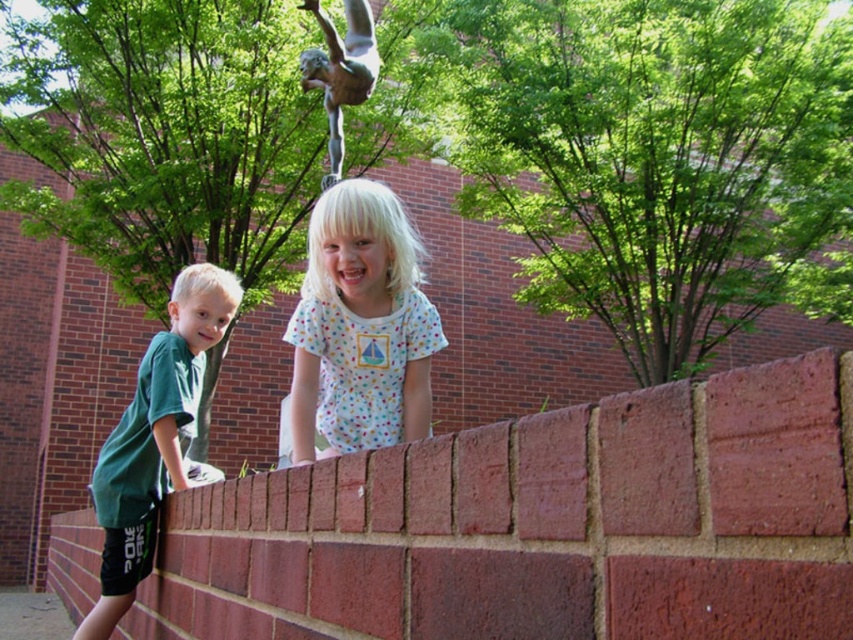
Question: From the image, what is the correct spatial relationship of green matte shirt at left in relation to green patina statue at upper center?

Choices:
 (A) right
 (B) left

Answer: (B)

Question: Where is green matte shirt at left located in relation to green patina statue at upper center in the image?

Choices:
 (A) right
 (B) left

Answer: (B)

Question: Based on their relative distances, which object is nearer to the brick wall at center?

Choices:
 (A) white dotted shirt at center
 (B) green patina statue at upper center

Answer: (A)

Question: Which object is farther from the camera taking this photo?

Choices:
 (A) green matte shirt at left
 (B) green patina statue at upper center
 (C) brick wall at center
 (D) white dotted shirt at center

Answer: (B)

Question: Is brick wall at center to the left of green patina statue at upper center from the viewer's perspective?

Choices:
 (A) no
 (B) yes

Answer: (A)

Question: Which object is positioned farthest from the green matte shirt at left?

Choices:
 (A) brick wall at center
 (B) white dotted shirt at center
 (C) green patina statue at upper center

Answer: (C)